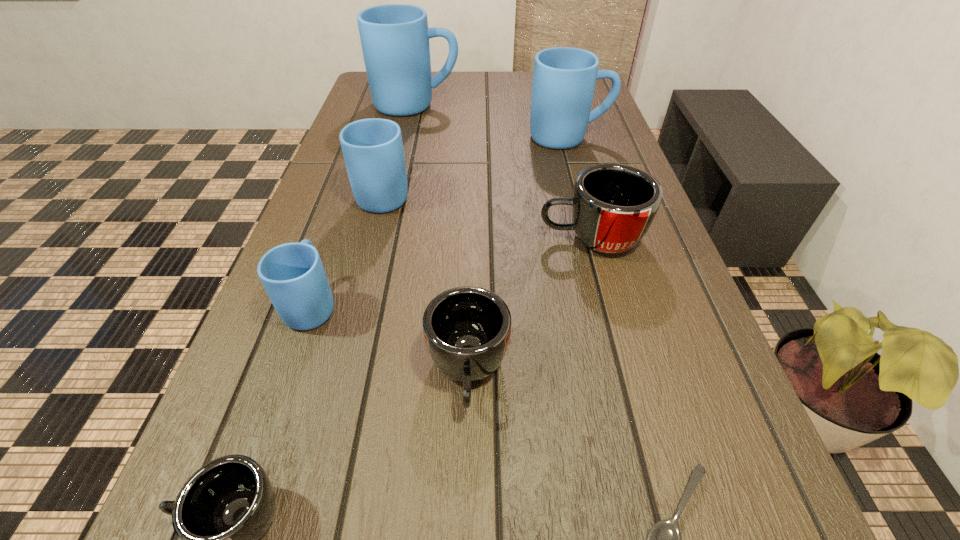
Identify the location of the sixth tallest mug. The width and height of the screenshot is (960, 540). (467, 329).

The image size is (960, 540). What are the coordinates of `vacant area situated 0.380m on the side of the farthest object with the handle` in the screenshot? It's located at pyautogui.click(x=583, y=105).

Find the location of a particular element. Image resolution: width=960 pixels, height=540 pixels. vacant space situated 0.140m on the side of the sixth shortest object with the handle is located at coordinates (397, 144).

Where is `vacant point located 0.050m on the side of the sixth shortest object with the handle`? vacant point located 0.050m on the side of the sixth shortest object with the handle is located at coordinates (393, 161).

Find the location of a particular element. The width and height of the screenshot is (960, 540). vacant space located on the side of the sixth shortest object with the handle is located at coordinates (401, 126).

Where is `free spot located 0.310m on the side of the farthest red mug with the handle`? The image size is (960, 540). free spot located 0.310m on the side of the farthest red mug with the handle is located at coordinates (392, 238).

This screenshot has height=540, width=960. Identify the location of vacant space situated on the side of the farthest red mug with the handle. (396, 238).

The width and height of the screenshot is (960, 540). I want to click on vacant space located on the side of the farthest red mug with the handle, so click(359, 238).

Where is `vacant space located 0.290m on the side of the smallest blue mug with the handle`? Image resolution: width=960 pixels, height=540 pixels. vacant space located 0.290m on the side of the smallest blue mug with the handle is located at coordinates (352, 190).

The height and width of the screenshot is (540, 960). Identify the location of vacant space located on the side of the smallest blue mug with the handle. (352, 190).